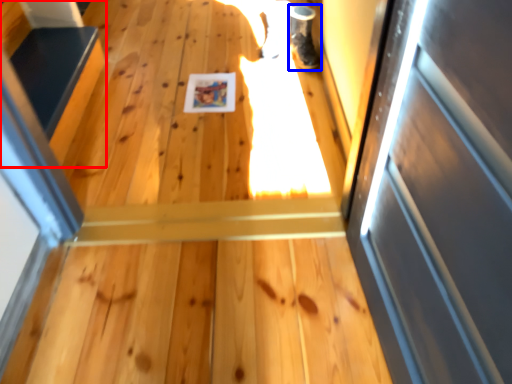
Question: Which object appears farthest to the camera in this image, stairs (highlighted by a red box) or shoe (highlighted by a blue box)?

Choices:
 (A) stairs
 (B) shoe

Answer: (B)